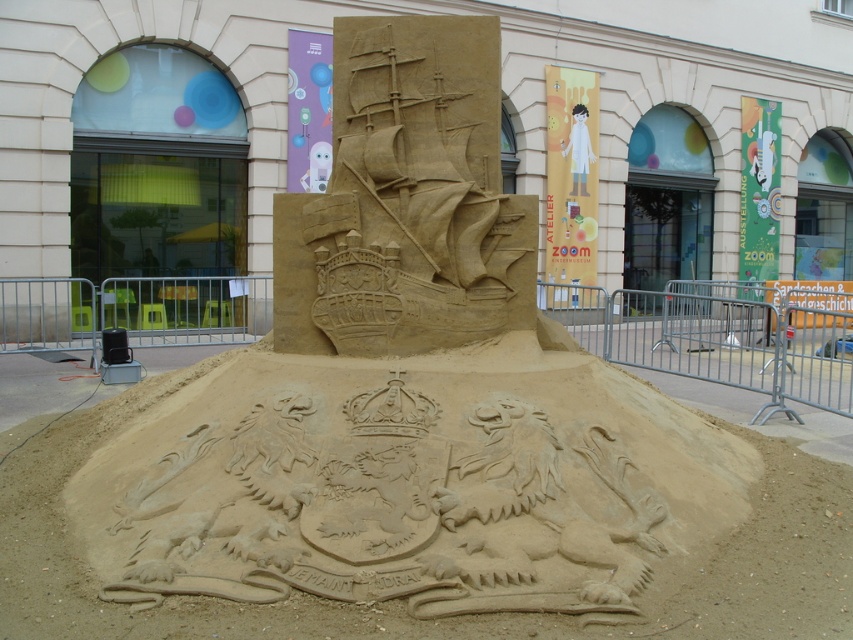
Question: Which object appears farthest from the camera in this image?

Choices:
 (A) natural sand at center
 (B) sandy ship at center

Answer: (B)

Question: Is natural sand at center positioned at the back of sandy ship at center?

Choices:
 (A) no
 (B) yes

Answer: (A)

Question: Can you confirm if natural sand at center is positioned to the left of sandy ship at center?

Choices:
 (A) yes
 (B) no

Answer: (B)

Question: Is natural sand at center wider than sandy ship at center?

Choices:
 (A) yes
 (B) no

Answer: (A)